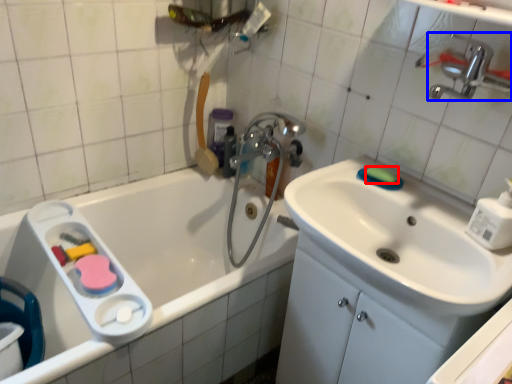
Question: Which of the following is the closest to the observer, soap (highlighted by a red box) or tap (highlighted by a blue box)?

Choices:
 (A) soap
 (B) tap

Answer: (B)